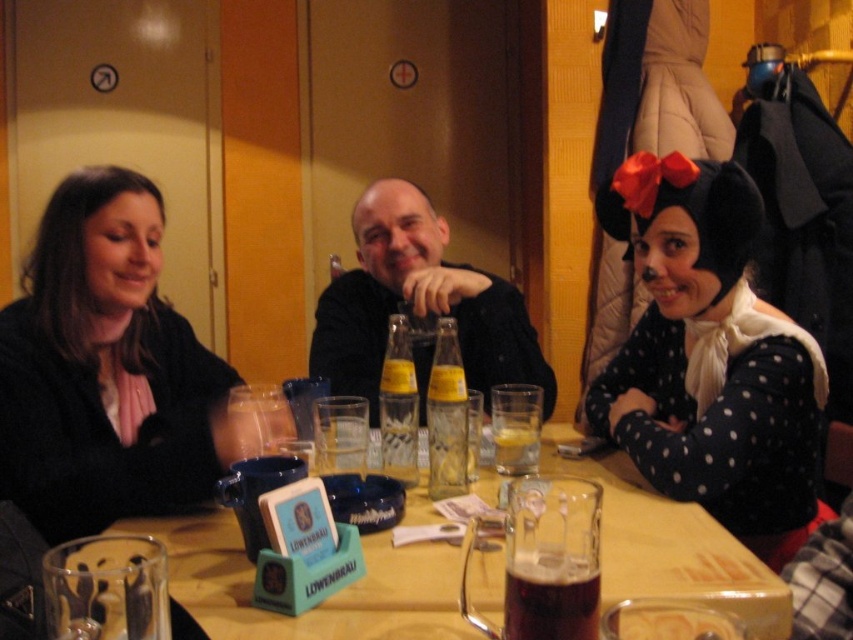
Question: Observing the image, what is the correct spatial positioning of black felt hat at upper right in reference to translucent glass mug at center?

Choices:
 (A) below
 (B) above

Answer: (B)

Question: Which is nearer to the black felt hat at upper right?

Choices:
 (A) translucent glass mug at center
 (B) black matte shirt at center

Answer: (A)

Question: Does translucent glass mug at center appear under black matte shirt at center?

Choices:
 (A) yes
 (B) no

Answer: (A)

Question: Is black matte shirt at center closer to the viewer compared to dark amber glass at table center?

Choices:
 (A) no
 (B) yes

Answer: (A)

Question: Estimate the real-world distances between objects in this image. Which object is closer to the black felt hat at upper right?

Choices:
 (A) translucent glass beer at table center
 (B) matte black sweater at left

Answer: (A)

Question: Which object is the farthest from the dark amber glass at table center?

Choices:
 (A) translucent glass mug at center
 (B) black matte shirt at center
 (C) black felt hat at upper right
 (D) matte black sweater at left

Answer: (B)